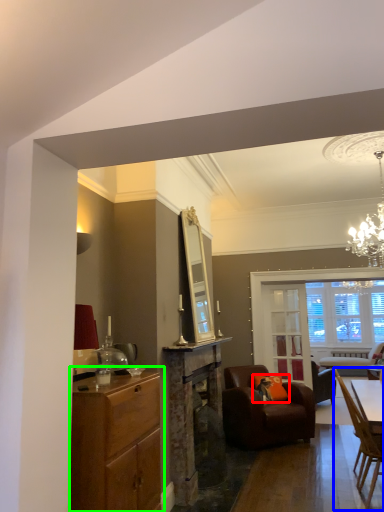
Question: Which object is positioned farthest from pillow (highlighted by a red box)? Select from chair (highlighted by a blue box) and cabinetry (highlighted by a green box).

Choices:
 (A) chair
 (B) cabinetry

Answer: (B)